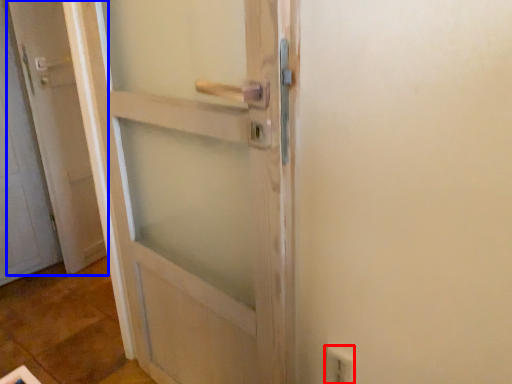
Question: Which point is closer to the camera, electric outlet (highlighted by a red box) or door (highlighted by a blue box)?

Choices:
 (A) electric outlet
 (B) door

Answer: (A)